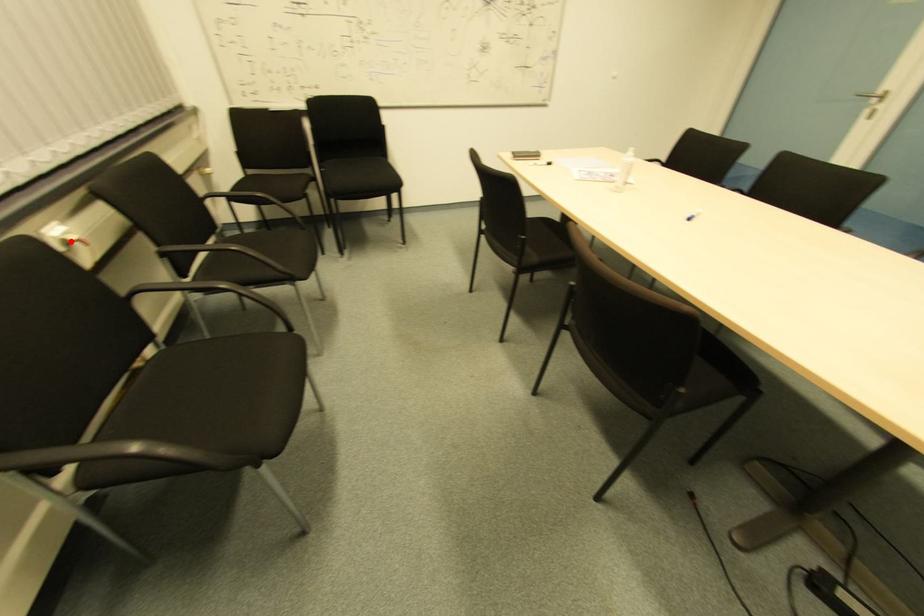
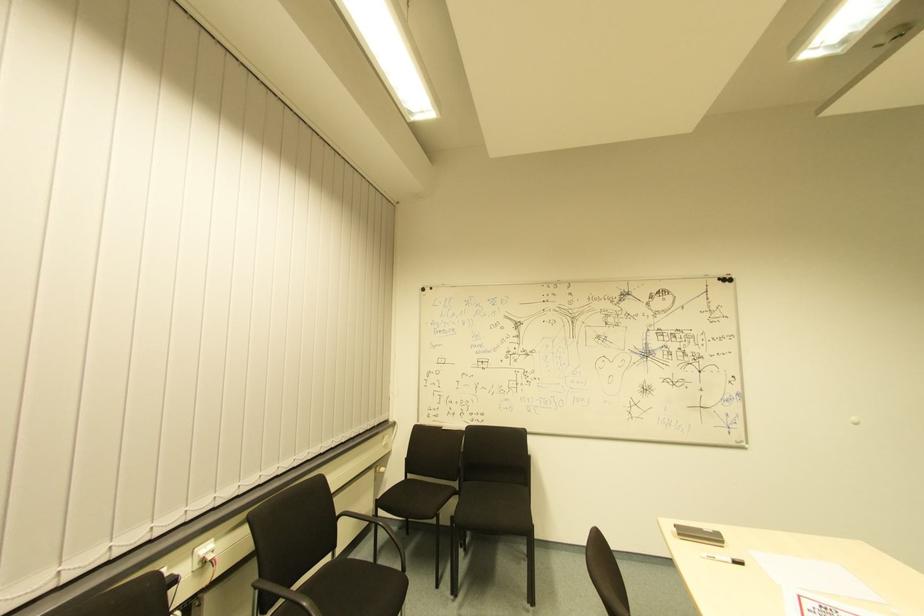
Question: A red point is marked in image1. In image2, is the corresponding 3D point closer to the camera or farther? Reply with the corresponding letter.

Choices:
 (A) The corresponding 3D point is closer.
 (B) The corresponding 3D point is farther.

Answer: (A)